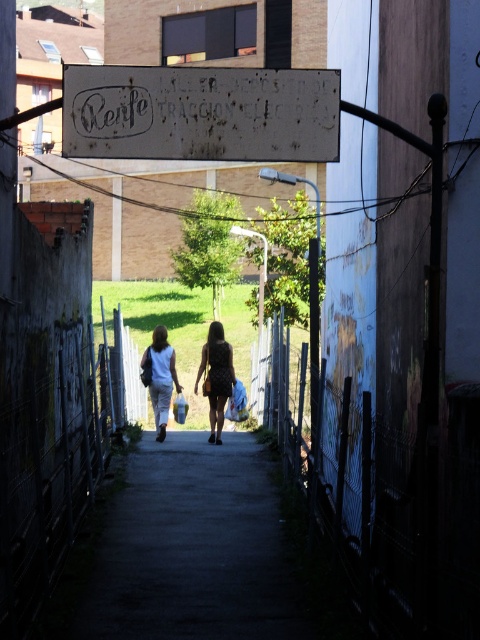
You are a delivery person trying to navigate through the alleyway. You see a rusty metal sign at upper center and a black dotted dress at center. Which object is larger in size?

The rusty metal sign at upper center is bigger than the black dotted dress at center.

You are standing at the entrance of the alleyway and see the black dotted dress at center. If you walk straight ahead, will the dress come into your line of sight before reaching the Renfe sign at the top of the alley?

The black dotted dress at center is located at coordinates [216,376], which is closer to the entrance than the Renfe sign at the top of the alley. Therefore, the dress will come into your line of sight before reaching the sign.

You are a pedestrian walking through the alleyway and notice the rusty metal sign at upper center and the light blue sleeveless top at center. Which object is closer to you as you look towards the end of the alley?

The rusty metal sign at upper center is closer to you because it is in front of the light blue sleeveless top at center.